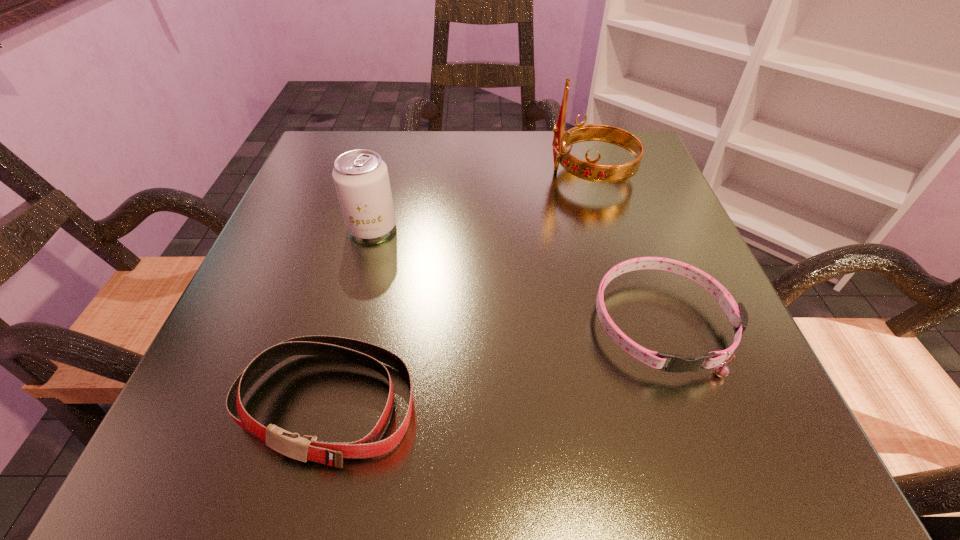
This screenshot has width=960, height=540. I want to click on the tallest object, so click(590, 171).

Locate an element on the screen. The image size is (960, 540). the farthest object is located at coordinates (590, 171).

Identify the location of the third shortest object. (361, 179).

Image resolution: width=960 pixels, height=540 pixels. I want to click on the second farthest object, so click(361, 179).

Where is `the second shortest object`? The height and width of the screenshot is (540, 960). the second shortest object is located at coordinates (304, 448).

Image resolution: width=960 pixels, height=540 pixels. I want to click on the left dog collar, so click(304, 448).

Where is `the right dog collar`? The image size is (960, 540). the right dog collar is located at coordinates (736, 313).

In order to click on the shorter dog collar in this screenshot , I will do click(736, 313).

Where is `vacant position located on the front-facing side of the tallest object`? This screenshot has height=540, width=960. vacant position located on the front-facing side of the tallest object is located at coordinates (432, 173).

Locate an element on the screen. The width and height of the screenshot is (960, 540). free space located 0.300m on the front-facing side of the tallest object is located at coordinates (403, 173).